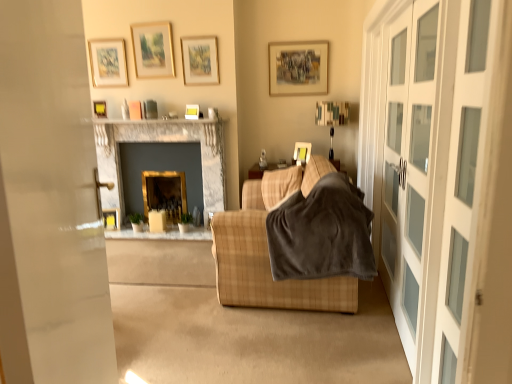
Question: Is point (227, 294) closer or farther from the camera than point (117, 226)?

Choices:
 (A) farther
 (B) closer

Answer: (B)

Question: Considering the positions of plaid fabric couch at center and wooden picture frame at lower left, the seventh picture frame from the right, in the image, is plaid fabric couch at center bigger or smaller than wooden picture frame at lower left, the seventh picture frame from the right,?

Choices:
 (A) big
 (B) small

Answer: (A)

Question: Based on their relative distances, which object is nearer to the marble fireplace at upper center?

Choices:
 (A) matte brown picture frame at upper center, which appears as the seventh picture frame when viewed from the left
 (B) gold metallic fireplace at center, the first fireplace from the right
 (C) velvety brown blanket at center
 (D) matte yellow picture frame at upper center, the eighth picture frame positioned from the left
 (E) matte wooden picture frame at upper center, the third picture frame positioned from the right

Answer: (E)

Question: Estimate the real-world distances between objects in this image. Which object is closer to the gold metallic fireplace at center, the first fireplace from the right?

Choices:
 (A) matte wooden picture frame at upper center, which appears as the 6th picture frame when viewed from the left
 (B) velvety brown blanket at center
 (C) matte gold picture frame at upper center, the 5th picture frame in the right-to-left sequence
 (D) plaid fabric couch at center
 (E) matte yellow picture frame at upper left, the 1th picture frame viewed from the left

Answer: (E)